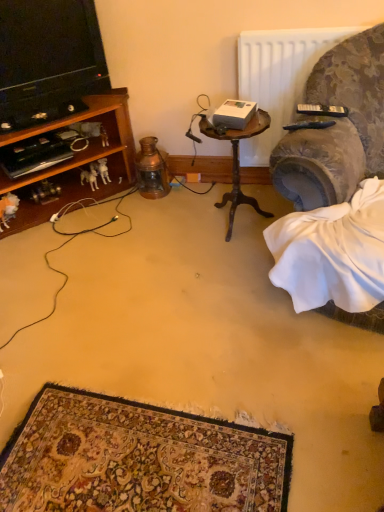
The image size is (384, 512). What are the coordinates of `vacant space in front of white fabric at lower right` in the screenshot? It's located at (308, 399).